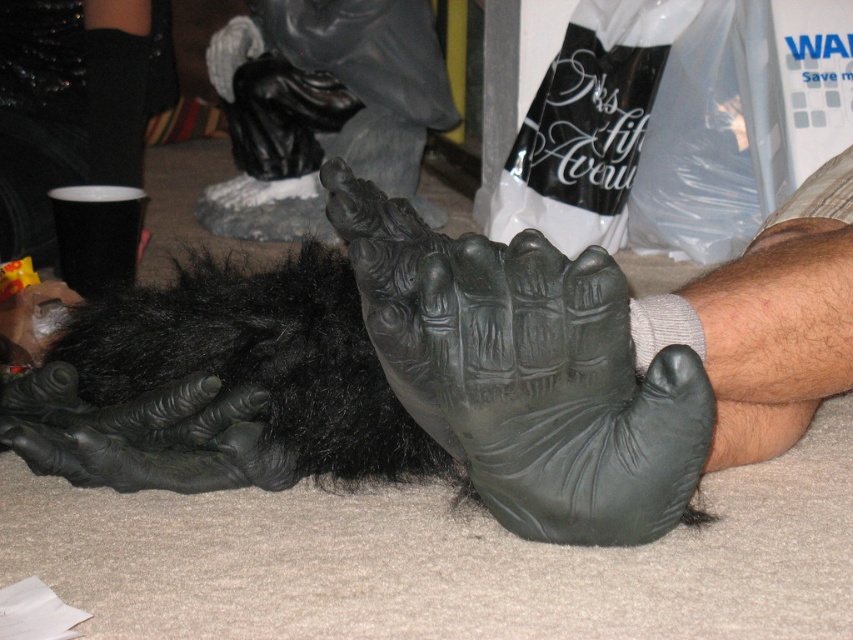
Question: Considering the relative positions of rubber-like black hand at center and black rubber glove at lower left in the image provided, where is rubber-like black hand at center located with respect to black rubber glove at lower left?

Choices:
 (A) left
 (B) right

Answer: (B)

Question: Is rubber-like black hand at center below black rubber glove at lower left?

Choices:
 (A) no
 (B) yes

Answer: (A)

Question: Which point is farther from the camera taking this photo?

Choices:
 (A) (218, 422)
 (B) (523, 349)

Answer: (A)

Question: Does rubber-like black hand at center appear over black rubber glove at lower left?

Choices:
 (A) yes
 (B) no

Answer: (A)

Question: Which point is closer to the camera taking this photo?

Choices:
 (A) (608, 465)
 (B) (247, 472)

Answer: (A)